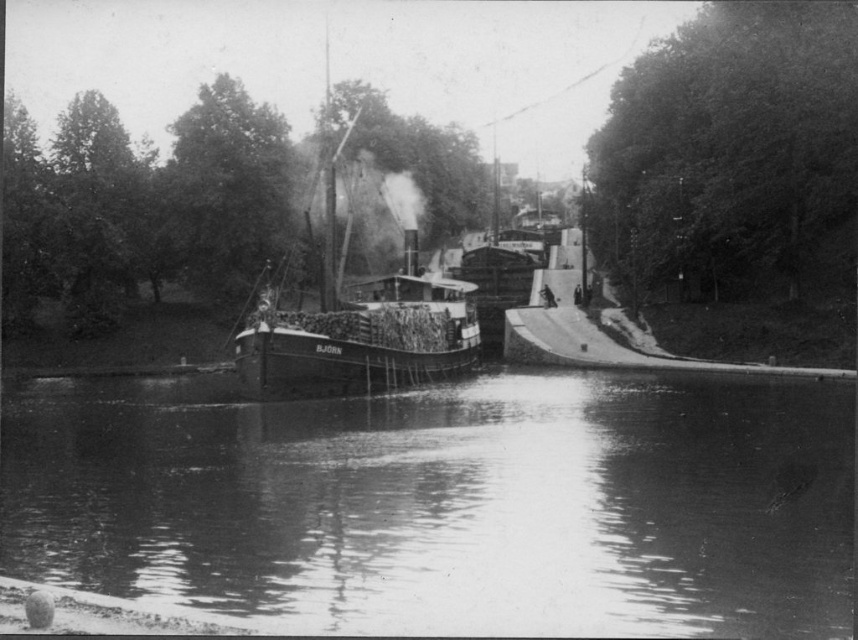
You are standing at the edge of the canal near the steamboat BJ?RN and want to reach a specific point marked at coordinates point (801, 500). If you can walk 25 meters in a straight line, will you be able to reach that point?

The distance of point (801, 500) from viewer is 22.23 meters, so yes, you can reach it since it is within your 25 meters walking range.

You are a photographer standing on the embankment on the right side of the canal. You want to capture a photo of the wooden steamboat at center and the smooth water at center. Based on their positions, which object should appear higher in your photo?

The wooden steamboat at center appears higher in the photo because it is positioned above the smooth water at center.

You are a photographer standing on the embankment on the right side of the canal. You want to capture a photo of the wooden steamboat at center and the smooth water at center. According to the scene, which object should be placed to the right in your photo?

The smooth water at center is positioned on the right side of wooden steamboat at center, so in your photo, the smooth water at center should be placed to the right of the wooden steamboat at center.